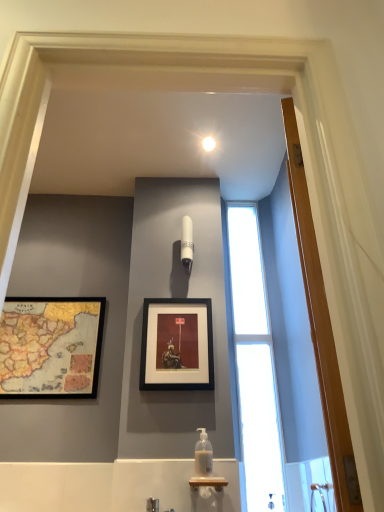
Locate an element on the screen. This screenshot has height=512, width=384. white glossy light fixture at upper center is located at coordinates (187, 244).

Measure the distance between point (189, 260) and camera.

Point (189, 260) is 7.38 feet away from camera.

This screenshot has width=384, height=512. Find the location of `wooden door at right`. wooden door at right is located at coordinates (321, 327).

Describe the element at coordinates (255, 365) in the screenshot. I see `transparent glass window at center` at that location.

Image resolution: width=384 pixels, height=512 pixels. Describe the element at coordinates (208, 143) in the screenshot. I see `white glossy light fixture at upper center` at that location.

Find the location of `brushed metal faucet at lower center`. brushed metal faucet at lower center is located at coordinates (152, 505).

What are the coordinates of `black matte picture frame at center, the 2th picture frame when ordered from left to right` in the screenshot? It's located at (177, 345).

Locate an element on the screen. The image size is (384, 512). translucent plastic soap dispenser at center is located at coordinates (203, 455).

Does translucent plastic soap dispenser at center come behind white glossy light fixture at upper center?

No, it is in front of white glossy light fixture at upper center.

Considering the positions of point (203, 447) and point (186, 259), is point (203, 447) closer or farther from the camera than point (186, 259)?

Point (203, 447).

Locate an element on the screen. fixture above the translucent plastic soap dispenser at center (from a real-world perspective) is located at coordinates (187, 244).

How many degrees apart are the facing directions of translucent plastic soap dispenser at center and white glossy light fixture at upper center?

The angle between the facing direction of translucent plastic soap dispenser at center and the facing direction of white glossy light fixture at upper center is 1.78 degrees.

How many degrees apart are the facing directions of white glossy light fixture at upper center and black matte picture frame at center, which is counted as the first picture frame, starting from the right?

4.11 degrees.

Is point (183, 248) positioned after point (206, 379)?

Yes, it is behind point (206, 379).

In the scene shown: Between white glossy light fixture at upper center and black matte picture frame at center, which is counted as the first picture frame, starting from the right, which one is positioned behind?

white glossy light fixture at upper center is behind.

Consider the image. Is white glossy light fixture at upper center inside or outside of black matte picture frame at center, which is counted as the first picture frame, starting from the right?

white glossy light fixture at upper center is not enclosed by black matte picture frame at center, which is counted as the first picture frame, starting from the right.

Is brushed metal faucet at lower center facing towards wooden framed map at left, arranged as the 2th picture frame when viewed from the right?

No, brushed metal faucet at lower center is not facing towards wooden framed map at left, arranged as the 2th picture frame when viewed from the right.

Measure the distance from brushed metal faucet at lower center to wooden framed map at left, the first picture frame from the left.

brushed metal faucet at lower center is 90.43 centimeters away from wooden framed map at left, the first picture frame from the left.

Considering the sizes of brushed metal faucet at lower center and wooden framed map at left, the first picture frame from the left, in the image, is brushed metal faucet at lower center bigger or smaller than wooden framed map at left, the first picture frame from the left,?

brushed metal faucet at lower center is smaller than wooden framed map at left, the first picture frame from the left.

Which is behind, point (147, 511) or point (22, 320)?

Positioned behind is point (22, 320).

From a real-world perspective, is white glossy light fixture at upper center on top of wooden framed map at left, arranged as the 2th picture frame when viewed from the right?

Yes, from a real-world perspective, white glossy light fixture at upper center is on top of wooden framed map at left, arranged as the 2th picture frame when viewed from the right.

Looking at this image, can you confirm if white glossy light fixture at upper center is wider than wooden framed map at left, arranged as the 2th picture frame when viewed from the right?

Yes, white glossy light fixture at upper center is wider than wooden framed map at left, arranged as the 2th picture frame when viewed from the right.

Which picture frame is the 2nd one when counting from the left side of the white glossy light fixture at upper center? Please provide its 2D coordinates.

[(51, 347)]

Consider the image. Which point is more distant from viewer, (243, 405) or (202, 448)?

The point (243, 405) is more distant.

Is transparent glass window at center inside or outside of translucent plastic soap dispenser at center?

transparent glass window at center cannot be found inside translucent plastic soap dispenser at center.

Looking at the image, does transparent glass window at center seem bigger or smaller compared to translucent plastic soap dispenser at center?

In the image, transparent glass window at center appears to be larger than translucent plastic soap dispenser at center.

Could you tell me if wooden framed map at left, the first picture frame from the left, is turned towards black matte picture frame at center, the 2th picture frame when ordered from left to right?

No, wooden framed map at left, the first picture frame from the left, is not turned towards black matte picture frame at center, the 2th picture frame when ordered from left to right.

Between wooden framed map at left, the first picture frame from the left, and black matte picture frame at center, the 2th picture frame when ordered from left to right, which one has less height?

black matte picture frame at center, the 2th picture frame when ordered from left to right, is shorter.

What's the angular difference between wooden framed map at left, arranged as the 2th picture frame when viewed from the right, and black matte picture frame at center, which is counted as the first picture frame, starting from the right,'s facing directions?

wooden framed map at left, arranged as the 2th picture frame when viewed from the right, and black matte picture frame at center, which is counted as the first picture frame, starting from the right, are facing 0.0355 degrees away from each other.

Is wooden framed map at left, arranged as the 2th picture frame when viewed from the right, in front of or behind black matte picture frame at center, which is counted as the first picture frame, starting from the right, in the image?

wooden framed map at left, arranged as the 2th picture frame when viewed from the right, is positioned farther from the viewer than black matte picture frame at center, which is counted as the first picture frame, starting from the right.

Considering the sizes of objects wooden framed map at left, the first picture frame from the left, and white glossy light fixture at upper center in the image provided, who is bigger, wooden framed map at left, the first picture frame from the left, or white glossy light fixture at upper center?

wooden framed map at left, the first picture frame from the left, is bigger.

From the image's perspective, is wooden framed map at left, arranged as the 2th picture frame when viewed from the right, beneath white glossy light fixture at upper center?

Correct, wooden framed map at left, arranged as the 2th picture frame when viewed from the right, appears lower than white glossy light fixture at upper center in the image.

Would you say wooden framed map at left, arranged as the 2th picture frame when viewed from the right, is outside white glossy light fixture at upper center?

Indeed, wooden framed map at left, arranged as the 2th picture frame when viewed from the right, is completely outside white glossy light fixture at upper center.

In the image, there is a white glossy light fixture at upper center. Where is `bottle below it (from a real-world perspective)`? bottle below it (from a real-world perspective) is located at coordinates (203, 455).

Which picture frame is the 1st one when counting from the left side of the white glossy light fixture at upper center? Please provide its 2D coordinates.

[(177, 345)]

Looking at the image, which one is located further to transparent glass window at center, translucent plastic soap dispenser at center or white glossy light fixture at upper center?

white glossy light fixture at upper center lies further to transparent glass window at center than the other object.

Based on their spatial positions, is translucent plastic soap dispenser at center or transparent glass window at center closer to black matte picture frame at center, the 2th picture frame when ordered from left to right?

translucent plastic soap dispenser at center.

Looking at the image, which one is located closer to white glossy light fixture at upper center, transparent glass window at center or brushed metal faucet at lower center?

Among the two, transparent glass window at center is located nearer to white glossy light fixture at upper center.

Based on their spatial positions, is black matte picture frame at center, which is counted as the first picture frame, starting from the right, or transparent glass window at center closer to translucent plastic soap dispenser at center?

black matte picture frame at center, which is counted as the first picture frame, starting from the right, is positioned closer to the anchor translucent plastic soap dispenser at center.

Based on their spatial positions, is translucent plastic soap dispenser at center or transparent glass window at center further from white glossy light fixture at upper center?

translucent plastic soap dispenser at center.

Considering their positions, is wooden framed map at left, the first picture frame from the left, positioned further to wooden door at right than white glossy light fixture at upper center?

Based on the image, wooden framed map at left, the first picture frame from the left, appears to be further to wooden door at right.

Considering their positions, is wooden framed map at left, the first picture frame from the left, positioned further to white glossy light fixture at upper center than brushed metal faucet at lower center?

brushed metal faucet at lower center is further to white glossy light fixture at upper center.

When comparing their distances from wooden door at right, does translucent plastic soap dispenser at center or white glossy light fixture at upper center seem closer?

translucent plastic soap dispenser at center.

At what (x,y) coordinates should I click in order to perform the action: click on fixture between white glossy light fixture at upper center and wooden framed map at left, arranged as the 2th picture frame when viewed from the right, in the vertical direction. Please return your answer as a coordinate pair (x, y). Image resolution: width=384 pixels, height=512 pixels. Looking at the image, I should click on (187, 244).

The image size is (384, 512). Identify the location of bottle between wooden framed map at left, the first picture frame from the left, and transparent glass window at center, in the horizontal direction. (203, 455).

Where is `faucet between wooden door at right and white glossy light fixture at upper center along the z-axis`? The image size is (384, 512). faucet between wooden door at right and white glossy light fixture at upper center along the z-axis is located at coordinates (152, 505).

Where is `fixture between white glossy light fixture at upper center and translucent plastic soap dispenser at center from top to bottom`? The height and width of the screenshot is (512, 384). fixture between white glossy light fixture at upper center and translucent plastic soap dispenser at center from top to bottom is located at coordinates (187, 244).